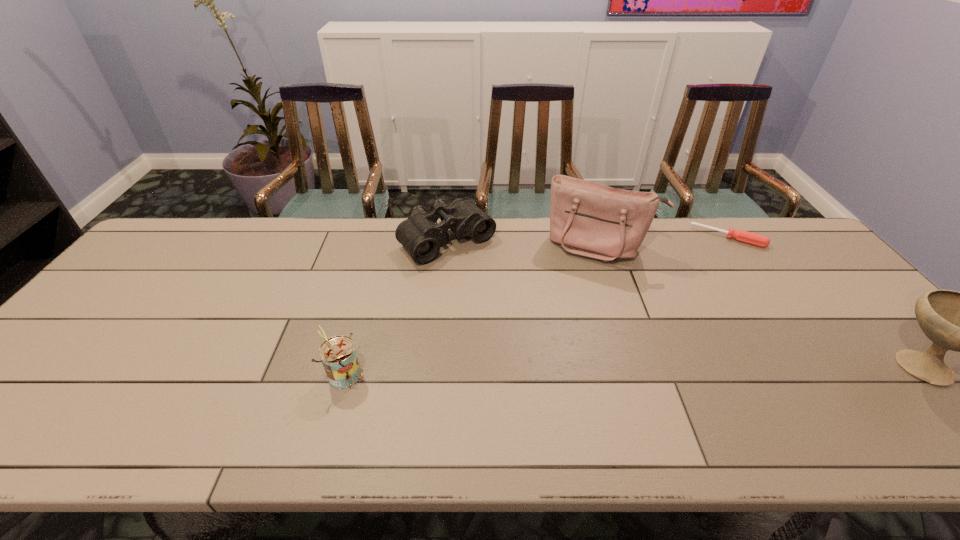
Identify the location of vacant space on the desktop that is between the third tallest object and the chalice and is positioned at the eyepieces of the second object from left to right. Image resolution: width=960 pixels, height=540 pixels. (572, 370).

You are a GUI agent. You are given a task and a screenshot of the screen. Output one action in this format:
    pyautogui.click(x=<x>, y=<y>)
    Task: Click on the free space on the desktop that is between the leftmost object and the chalice and is positioned at the blade of the shortest object
    
    Given the screenshot: What is the action you would take?
    pyautogui.click(x=698, y=368)

The height and width of the screenshot is (540, 960). Identify the location of vacant space on the desktop that is between the third shortest object and the rightmost object and is positioned on the front pocket of the shoulder bag. (562, 370).